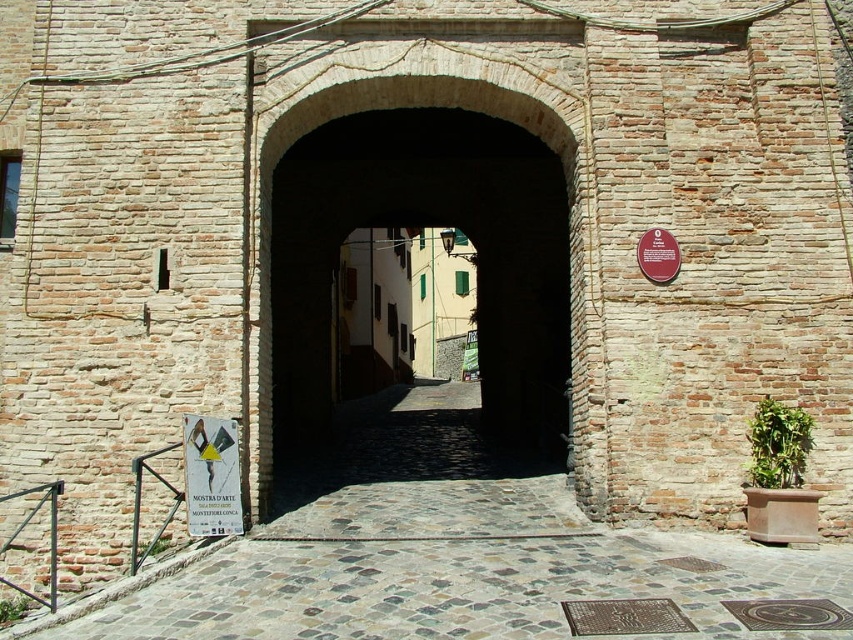
You are a delivery person trying to navigate through the historic stone archway. You see the smooth stone alley at center and the white paper sign at center. Which object is positioned lower from the ground?

The smooth stone alley at center is below the white paper sign at center, so the smooth stone alley at center is positioned lower from the ground.